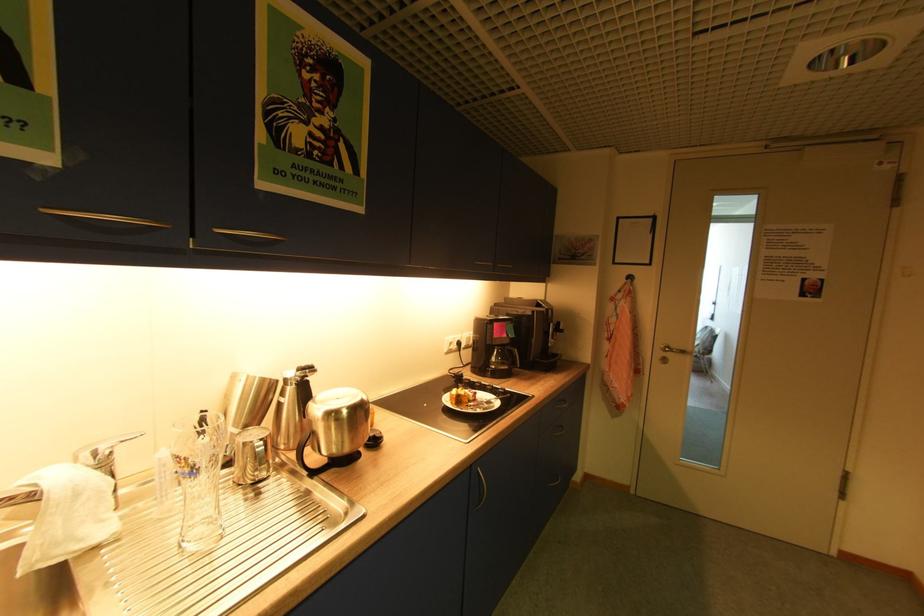
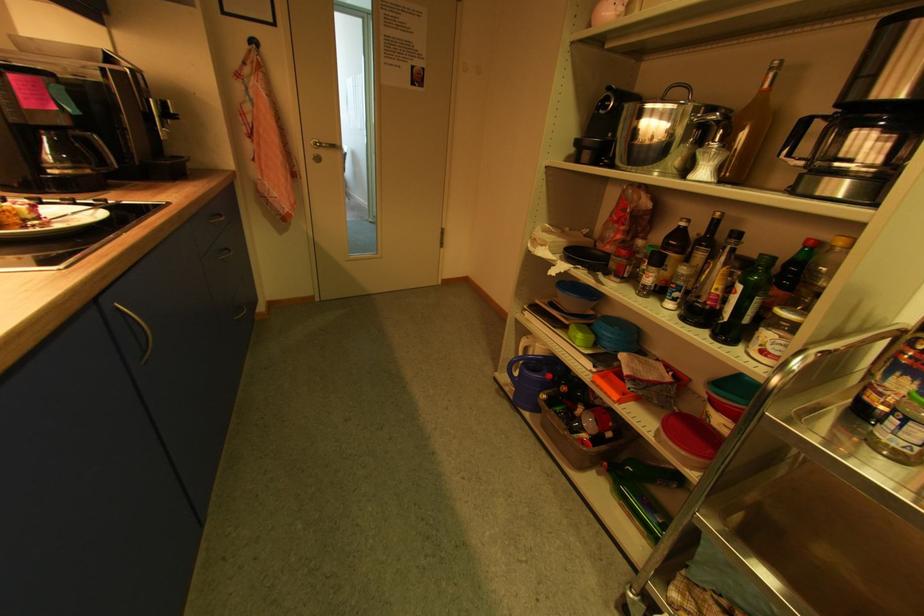
Locate, in the second image, the point that corresponds to the point at 673,350 in the first image.

(323, 146)